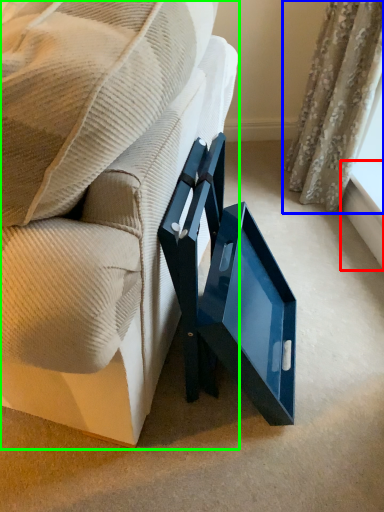
Question: Which object is positioned farthest from window sill (highlighted by a red box)? Select from curtain (highlighted by a blue box) and furniture (highlighted by a green box).

Choices:
 (A) curtain
 (B) furniture

Answer: (B)